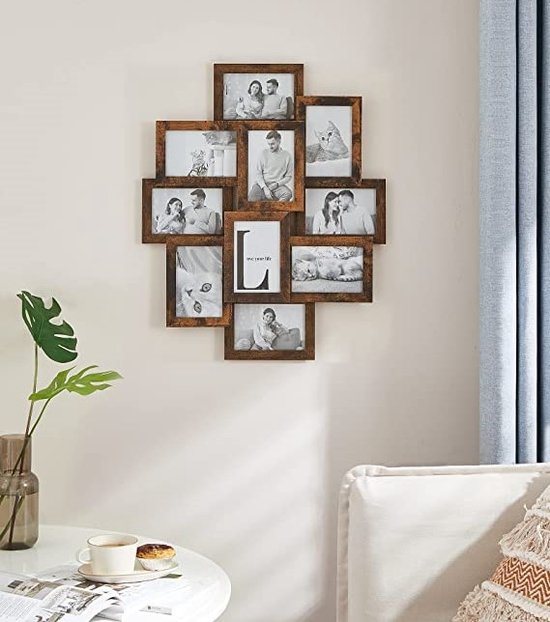
Locate an element on the screen. Image resolution: width=550 pixels, height=622 pixels. pictures in the frames is located at coordinates (287, 320), (195, 285), (264, 265), (343, 274), (354, 216), (324, 146), (273, 164), (184, 218), (205, 152), (268, 103).